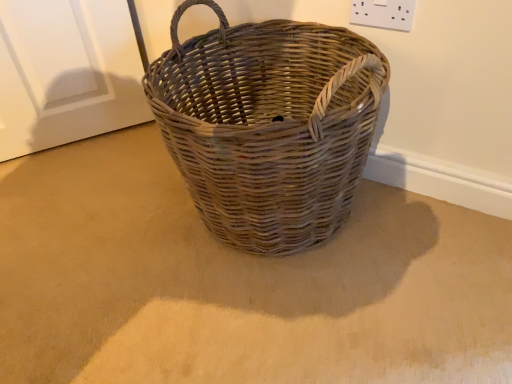
Question: In terms of size, does white plastic socket at upper right appear bigger or smaller than natural woven picnic basket at center?

Choices:
 (A) small
 (B) big

Answer: (A)

Question: In the image, is white plastic socket at upper right on the left side or the right side of natural woven picnic basket at center?

Choices:
 (A) right
 (B) left

Answer: (A)

Question: Considering their positions, is white plastic socket at upper right located in front of or behind natural woven picnic basket at center?

Choices:
 (A) behind
 (B) front

Answer: (A)

Question: Considering the positions of natural woven picnic basket at center and white plastic socket at upper right in the image, is natural woven picnic basket at center bigger or smaller than white plastic socket at upper right?

Choices:
 (A) big
 (B) small

Answer: (A)

Question: From the image's perspective, is natural woven picnic basket at center positioned above or below white plastic socket at upper right?

Choices:
 (A) above
 (B) below

Answer: (B)

Question: From a real-world perspective, relative to white plastic socket at upper right, is natural woven picnic basket at center vertically above or below?

Choices:
 (A) above
 (B) below

Answer: (B)

Question: In the image, is natural woven picnic basket at center on the left side or the right side of white plastic socket at upper right?

Choices:
 (A) right
 (B) left

Answer: (B)